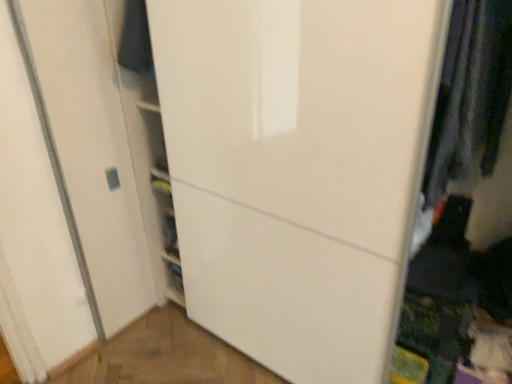
What are the coordinates of `dark blue fabric at upper left, positioned as the 2th clothing in front-to-back order` in the screenshot? It's located at (135, 39).

The height and width of the screenshot is (384, 512). Identify the location of white glossy door at center. (298, 170).

Where is `dark blue fabric at upper left, positioned as the 2th clothing in front-to-back order`? The width and height of the screenshot is (512, 384). dark blue fabric at upper left, positioned as the 2th clothing in front-to-back order is located at coordinates (135, 39).

From the image's perspective, is dark gray fabric at right, which is counted as the 1th clothing, starting from the front, positioned above or below white glossy door at center?

Clearly, from the image's perspective, dark gray fabric at right, which is counted as the 1th clothing, starting from the front, is above white glossy door at center.

Are dark gray fabric at right, marked as the second clothing in a left-to-right arrangement, and white glossy door at center located far from each other?

No, dark gray fabric at right, marked as the second clothing in a left-to-right arrangement, is in close proximity to white glossy door at center.

Which is more to the left, dark gray fabric at right, marked as the second clothing in a back-to-front arrangement, or white glossy door at center?

From the viewer's perspective, white glossy door at center appears more on the left side.

This screenshot has width=512, height=384. I want to click on clothing located in front of the dark blue fabric at upper left, which is counted as the first clothing, starting from the left, so click(470, 94).

Is dark gray fabric at right, positioned as the 1th clothing in right-to-left order, aimed at dark blue fabric at upper left, positioned as the 2th clothing in front-to-back order?

No, dark gray fabric at right, positioned as the 1th clothing in right-to-left order, is not turned towards dark blue fabric at upper left, positioned as the 2th clothing in front-to-back order.

Can you confirm if dark gray fabric at right, marked as the second clothing in a back-to-front arrangement, is positioned to the right of dark blue fabric at upper left, which is counted as the first clothing, starting from the left?

Correct, you'll find dark gray fabric at right, marked as the second clothing in a back-to-front arrangement, to the right of dark blue fabric at upper left, which is counted as the first clothing, starting from the left.

You are a GUI agent. You are given a task and a screenshot of the screen. Output one action in this format:
    pyautogui.click(x=<x>, y=<y>)
    Task: Click on the door below the dark blue fabric at upper left, which is the 2th clothing from right to left (from a real-world perspective)
    The width and height of the screenshot is (512, 384).
    Given the screenshot: What is the action you would take?
    298,170

Is point (224, 189) closer to camera compared to point (124, 16)?

That is True.

Is white glossy door at center not close to dark blue fabric at upper left, positioned as the 2th clothing in front-to-back order?

No, white glossy door at center is not far away from dark blue fabric at upper left, positioned as the 2th clothing in front-to-back order.

Looking at this image, is white glossy door at center not inside dark blue fabric at upper left, positioned as the 2th clothing in front-to-back order?

Yes, white glossy door at center is outside of dark blue fabric at upper left, positioned as the 2th clothing in front-to-back order.

Does white glossy door at center turn towards dark gray fabric at right, marked as the second clothing in a back-to-front arrangement?

No, white glossy door at center is not oriented towards dark gray fabric at right, marked as the second clothing in a back-to-front arrangement.

Image resolution: width=512 pixels, height=384 pixels. Find the location of `door that appears below the dark gray fabric at right, marked as the second clothing in a back-to-front arrangement (from the image's perspective)`. door that appears below the dark gray fabric at right, marked as the second clothing in a back-to-front arrangement (from the image's perspective) is located at coordinates (298, 170).

Is point (396, 134) closer or farther from the camera than point (507, 49)?

Point (396, 134) appears to be closer to the viewer than point (507, 49).

From the image's perspective, is white glossy door at center on top of dark gray fabric at right, marked as the second clothing in a back-to-front arrangement?

Actually, white glossy door at center appears below dark gray fabric at right, marked as the second clothing in a back-to-front arrangement, in the image.

Considering the relative sizes of dark blue fabric at upper left, which is counted as the first clothing, starting from the left, and dark gray fabric at right, marked as the second clothing in a back-to-front arrangement, in the image provided, is dark blue fabric at upper left, which is counted as the first clothing, starting from the left, taller than dark gray fabric at right, marked as the second clothing in a back-to-front arrangement,?

Incorrect, the height of dark blue fabric at upper left, which is counted as the first clothing, starting from the left, is not larger of that of dark gray fabric at right, marked as the second clothing in a back-to-front arrangement.

Visually, is dark blue fabric at upper left, positioned as the 2th clothing in front-to-back order, positioned to the left or to the right of dark gray fabric at right, marked as the second clothing in a left-to-right arrangement?

dark blue fabric at upper left, positioned as the 2th clothing in front-to-back order, is to the left of dark gray fabric at right, marked as the second clothing in a left-to-right arrangement.

How many degrees apart are the facing directions of dark blue fabric at upper left, which is the 2th clothing from right to left, and dark gray fabric at right, marked as the second clothing in a back-to-front arrangement?

The angle between the facing direction of dark blue fabric at upper left, which is the 2th clothing from right to left, and the facing direction of dark gray fabric at right, marked as the second clothing in a back-to-front arrangement, is 0.000493 degrees.

Would you say dark blue fabric at upper left, positioned as the 2th clothing in front-to-back order, is inside or outside dark gray fabric at right, which is counted as the 1th clothing, starting from the front?

The correct answer is: outside.

Locate an element on the screen. The height and width of the screenshot is (384, 512). clothing to the left of white glossy door at center is located at coordinates (135, 39).

From a real-world perspective, who is located lower, dark blue fabric at upper left, which is the 2th clothing from right to left, or white glossy door at center?

white glossy door at center.

Is dark blue fabric at upper left, positioned as the 2th clothing in front-to-back order, not close to white glossy door at center?

dark blue fabric at upper left, positioned as the 2th clothing in front-to-back order, is actually quite close to white glossy door at center.

Considering the points (119, 39) and (214, 295), which point is in front, point (119, 39) or point (214, 295)?

Positioned in front is point (119, 39).

Locate an element on the screen. the 1st clothing behind when counting from the white glossy door at center is located at coordinates click(470, 94).

In the image, there is a dark blue fabric at upper left, which is counted as the first clothing, starting from the left. At what (x,y) coordinates should I click in order to perform the action: click on clothing below it (from a real-world perspective). Please return your answer as a coordinate pair (x, y). Looking at the image, I should click on (470, 94).

Considering their positions, is dark gray fabric at right, positioned as the 1th clothing in right-to-left order, positioned further to white glossy door at center than dark blue fabric at upper left, positioned as the 2th clothing in front-to-back order?

dark blue fabric at upper left, positioned as the 2th clothing in front-to-back order.

Based on their spatial positions, is dark blue fabric at upper left, which is counted as the first clothing, starting from the left, or white glossy door at center further from dark gray fabric at right, which is counted as the 1th clothing, starting from the front?

dark blue fabric at upper left, which is counted as the first clothing, starting from the left, lies further to dark gray fabric at right, which is counted as the 1th clothing, starting from the front, than the other object.

Considering their positions, is white glossy door at center positioned closer to dark gray fabric at right, marked as the second clothing in a left-to-right arrangement, than dark blue fabric at upper left, positioned as the 2th clothing in front-to-back order?

white glossy door at center is positioned closer to the anchor dark gray fabric at right, marked as the second clothing in a left-to-right arrangement.

From the image, which object appears to be nearer to white glossy door at center, dark blue fabric at upper left, which is the 2th clothing from right to left, or dark gray fabric at right, which is counted as the 1th clothing, starting from the front?

Among the two, dark gray fabric at right, which is counted as the 1th clothing, starting from the front, is located nearer to white glossy door at center.

When comparing their distances from dark blue fabric at upper left, the 1th clothing from the back, does white glossy door at center or dark gray fabric at right, marked as the second clothing in a back-to-front arrangement, seem further?

dark gray fabric at right, marked as the second clothing in a back-to-front arrangement, lies further to dark blue fabric at upper left, the 1th clothing from the back, than the other object.

Based on their spatial positions, is dark gray fabric at right, positioned as the 1th clothing in right-to-left order, or white glossy door at center further from dark blue fabric at upper left, which is the 2th clothing from right to left?

The object further to dark blue fabric at upper left, which is the 2th clothing from right to left, is dark gray fabric at right, positioned as the 1th clothing in right-to-left order.

You are a GUI agent. You are given a task and a screenshot of the screen. Output one action in this format:
    pyautogui.click(x=<x>, y=<y>)
    Task: Click on the door between dark blue fabric at upper left, positioned as the 2th clothing in front-to-back order, and dark gray fabric at right, marked as the second clothing in a left-to-right arrangement, from left to right
    
    Given the screenshot: What is the action you would take?
    pyautogui.click(x=298, y=170)